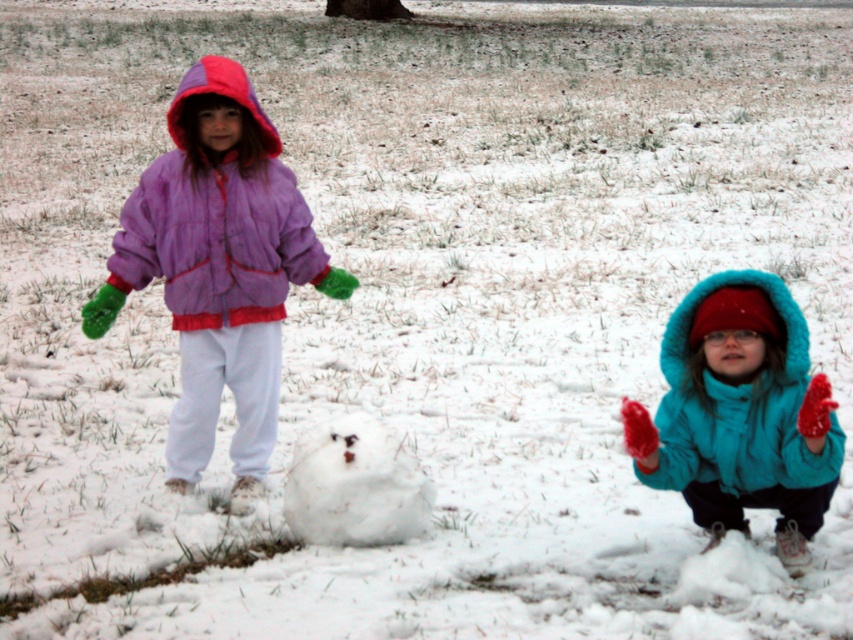
Does point (270, 314) come farther from viewer compared to point (332, 524)?

Yes, point (270, 314) is behind point (332, 524).

Where is `matte purple jacket at left`? The width and height of the screenshot is (853, 640). matte purple jacket at left is located at coordinates (218, 268).

Is turquoise fleece jacket at lower right bigger than white fluffy snowman at center?

Yes, turquoise fleece jacket at lower right is bigger than white fluffy snowman at center.

Is turquoise fleece jacket at lower right thinner than white fluffy snowman at center?

No, turquoise fleece jacket at lower right is not thinner than white fluffy snowman at center.

Looking at this image, who is more forward, (680, 467) or (397, 440)?

Point (680, 467) is in front.

The height and width of the screenshot is (640, 853). What are the coordinates of `turquoise fleece jacket at lower right` in the screenshot? It's located at click(x=738, y=408).

Looking at this image, is matte purple jacket at left wider than purple fleece jacket at upper left?

Yes, matte purple jacket at left is wider than purple fleece jacket at upper left.

Does point (242, 324) come behind point (270, 189)?

Yes, it is behind point (270, 189).

At what (x,y) coordinates should I click in order to perform the action: click on matte purple jacket at left. Please return your answer as a coordinate pair (x, y). The width and height of the screenshot is (853, 640). Looking at the image, I should click on (218, 268).